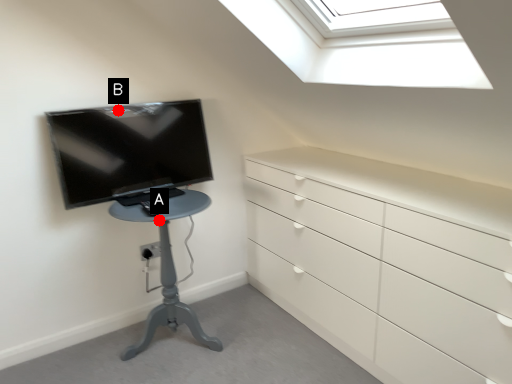
Question: Two points are circled on the image, labeled by A and B beside each circle. Which point is farther to the camera?

Choices:
 (A) A is further
 (B) B is further

Answer: (B)